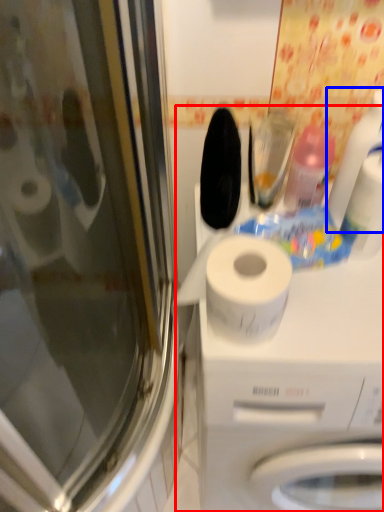
Question: Among these objects, which one is nearest to the camera, machine (highlighted by a red box) or cleaning product (highlighted by a blue box)?

Choices:
 (A) machine
 (B) cleaning product

Answer: (A)